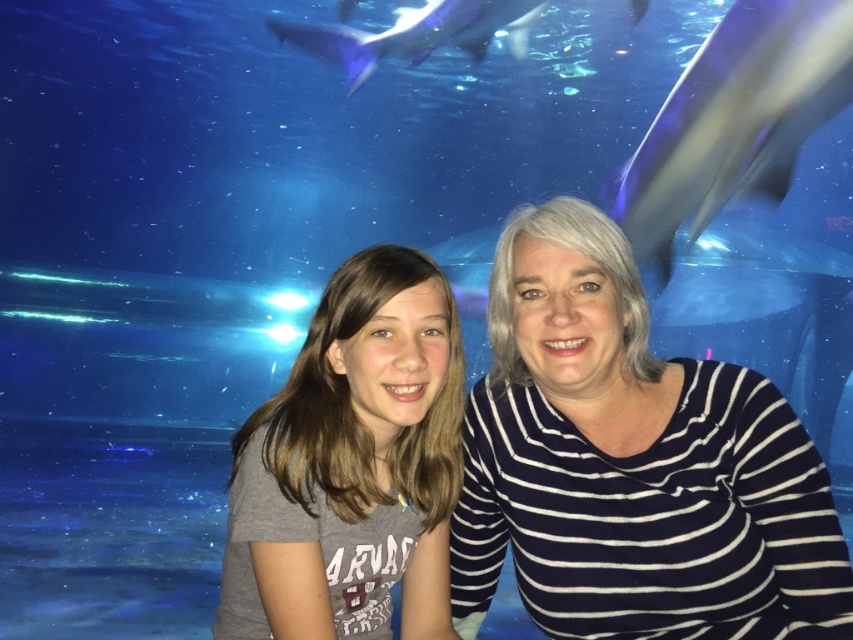
Can you confirm if white striped shirt at center is wider than gray matte shirt at center?

Yes, white striped shirt at center is wider than gray matte shirt at center.

From the picture: Between white striped shirt at center and gray matte shirt at center, which one has less height?

gray matte shirt at center is shorter.

Is point (616, 467) positioned behind point (357, 284)?

Yes, point (616, 467) is farther from viewer.

Image resolution: width=853 pixels, height=640 pixels. What are the coordinates of `white striped shirt at center` in the screenshot? It's located at (631, 465).

Does white striped shirt at center have a greater width compared to gray smooth shark at upper right?

No.

Who is higher up, white striped shirt at center or gray smooth shark at upper right?

gray smooth shark at upper right is higher up.

Where is `white striped shirt at center`? white striped shirt at center is located at coordinates (631, 465).

Is white striped shirt at center bigger than blue smooth shark at upper center?

Actually, white striped shirt at center might be smaller than blue smooth shark at upper center.

Is point (634, 410) positioned in front of point (523, 17)?

Yes, it is.

Image resolution: width=853 pixels, height=640 pixels. Identify the location of white striped shirt at center. (631, 465).

Where is `white striped shirt at center`? white striped shirt at center is located at coordinates (631, 465).